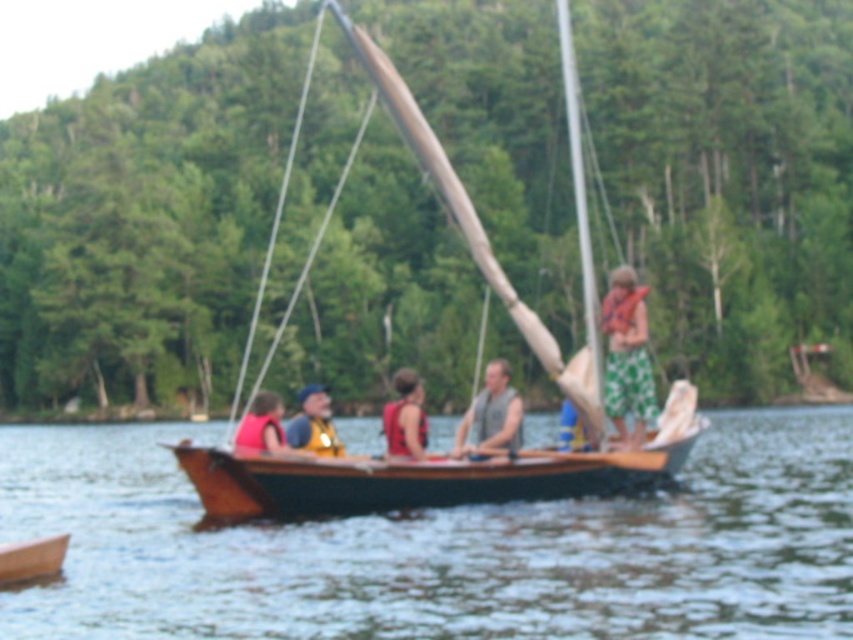
Is gray sleeveless shirt at center bigger than wooden life vest at center?

Incorrect, gray sleeveless shirt at center is not larger than wooden life vest at center.

Does gray sleeveless shirt at center have a smaller size compared to wooden life vest at center?

Yes.

What do you see at coordinates (491, 416) in the screenshot? I see `gray sleeveless shirt at center` at bounding box center [491, 416].

The height and width of the screenshot is (640, 853). Identify the location of gray sleeveless shirt at center. 491,416.

Does wooden life vest at center appear over blue fabric life vest at center?

Yes.

You are a GUI agent. You are given a task and a screenshot of the screen. Output one action in this format:
    pyautogui.click(x=<x>, y=<y>)
    Task: Click on the wooden life vest at center
    The height and width of the screenshot is (640, 853).
    Given the screenshot: What is the action you would take?
    pyautogui.click(x=314, y=422)

I want to click on wooden life vest at center, so click(314, 422).

In the scene shown: Between brown wooden boat at center and green floral shorts at right, which one is positioned lower?

brown wooden boat at center is lower down.

Which is more to the left, brown wooden boat at center or green floral shorts at right?

From the viewer's perspective, brown wooden boat at center appears more on the left side.

The width and height of the screenshot is (853, 640). I want to click on brown wooden boat at center, so click(442, 547).